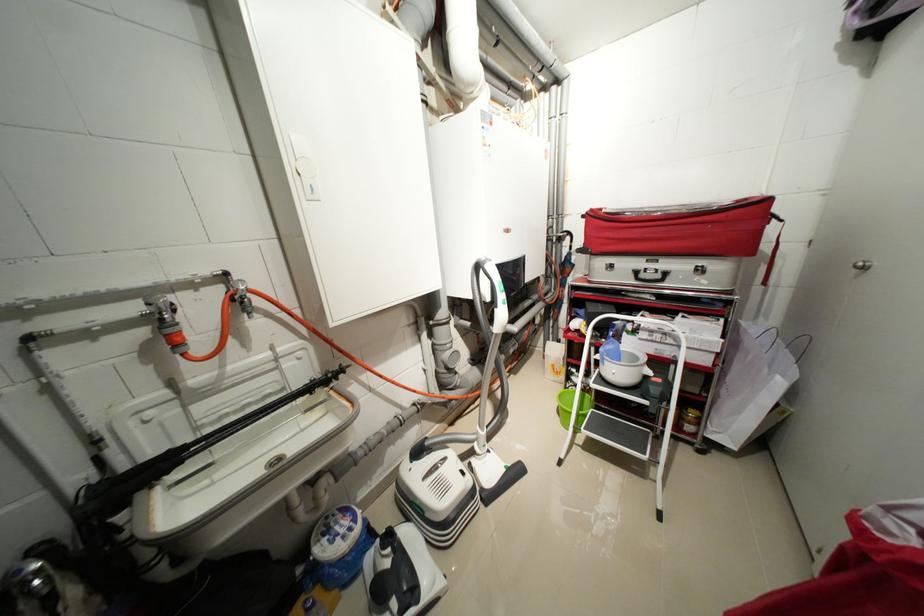
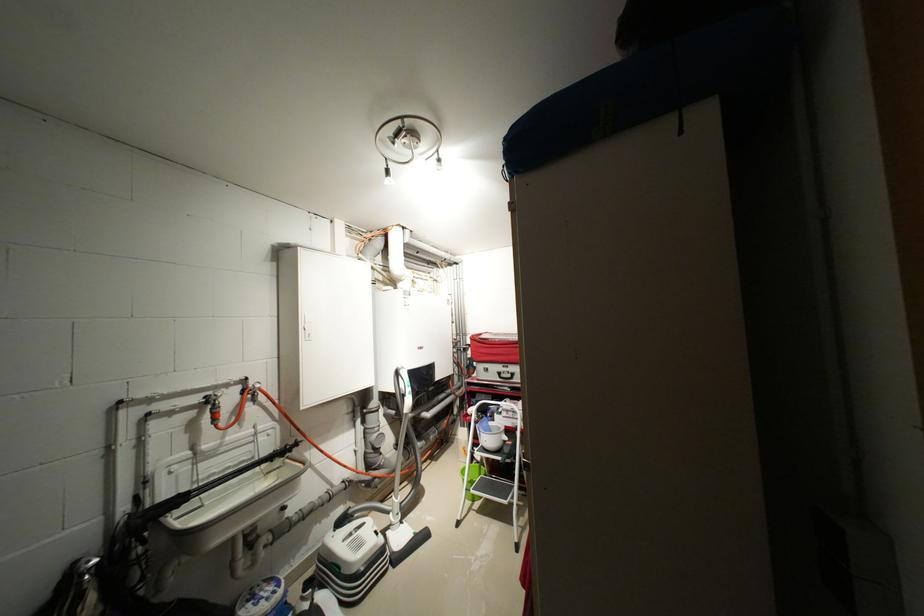
Find the pixel in the second image that matches pixel 598 345 in the first image.

(482, 424)